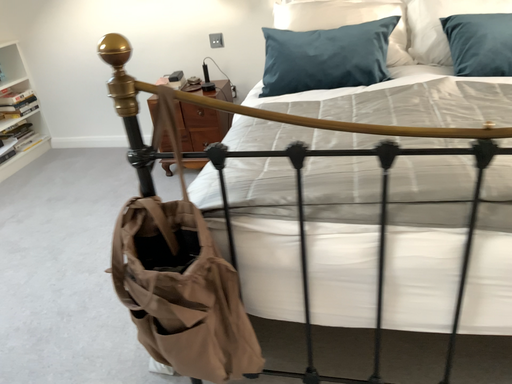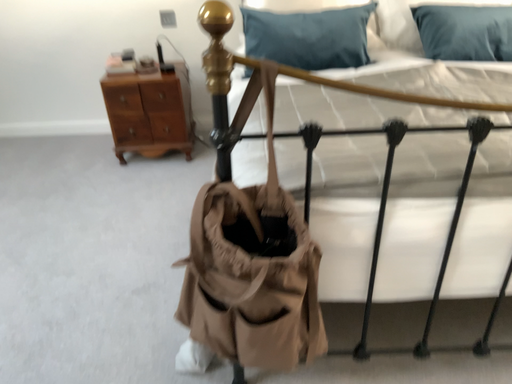
Question: Which way did the camera rotate in the video?

Choices:
 (A) rotated left
 (B) rotated right

Answer: (B)